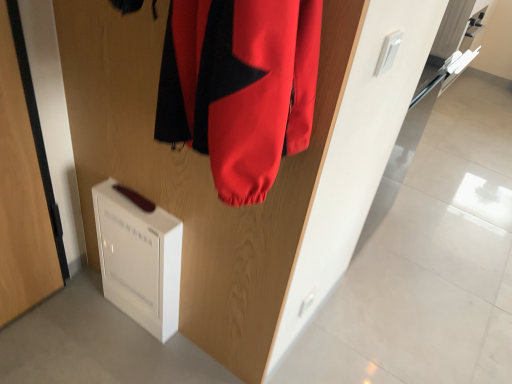
Question: Does point (2, 198) appear closer or farther from the camera than point (126, 205)?

Choices:
 (A) farther
 (B) closer

Answer: (B)

Question: Would you say white matte door at lower left, the 2th door positioned from the right, is inside or outside white plastic air purifier at lower left?

Choices:
 (A) inside
 (B) outside

Answer: (B)

Question: Considering the real-world distances, which object is closest to the white plastic air purifier at lower left?

Choices:
 (A) wooden door at center, placed as the 1th door when sorted from right to left
 (B) white matte door at lower left, which is counted as the first door, starting from the left

Answer: (A)

Question: Considering the real-world distances, which object is farthest from the white plastic air purifier at lower left?

Choices:
 (A) wooden door at center, placed as the 1th door when sorted from right to left
 (B) white matte door at lower left, which is counted as the first door, starting from the left

Answer: (B)